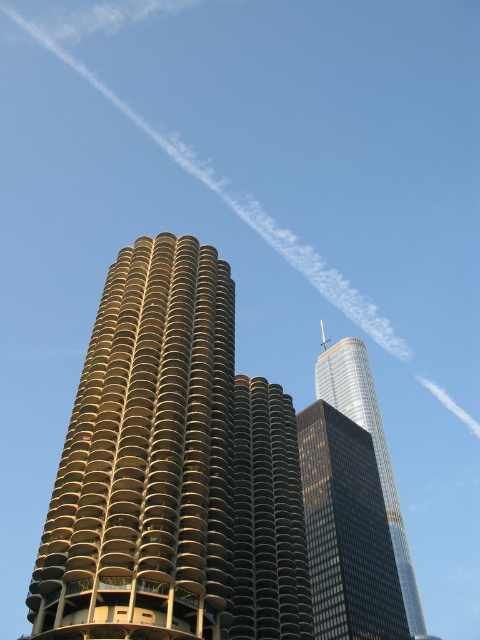
In the scene shown: You are an architect evaluating the two buildings in the city. Which building would you say is bigger in size between the gold metallic building at center and the dark gray concrete building at center?

The gold metallic building at center has a larger size compared to the dark gray concrete building at center, so the gold metallic building at center is bigger.

You are a drone operator who needs to fly a drone between the gold metallic building at center and the dark gray concrete building at center. The drone has a wingspan of 4 feet. Is there enough space for the drone to pass through the gap between them?

The gold metallic building at center and dark gray concrete building at center are 41.58 feet apart, which is more than enough space for a drone with a 4 feet wingspan to pass through safely.